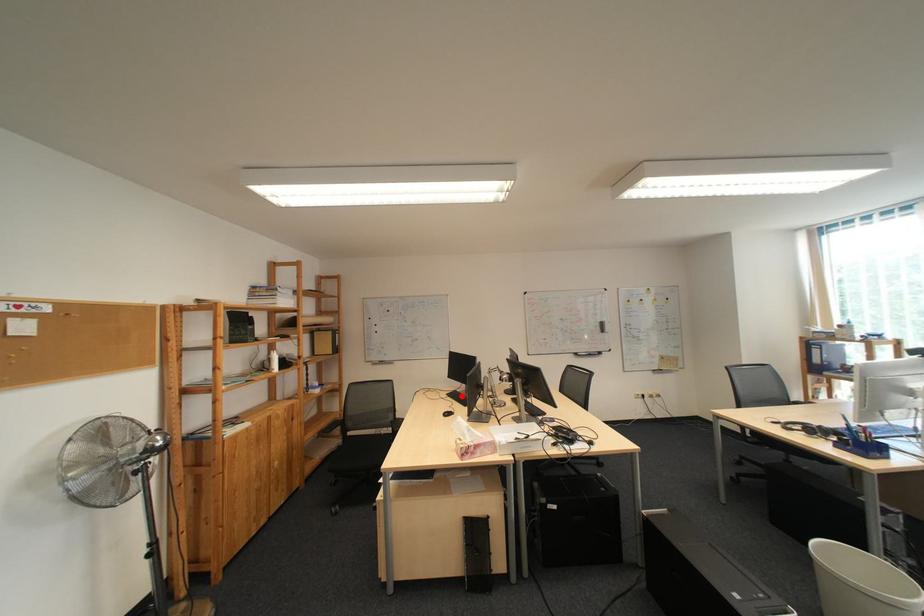
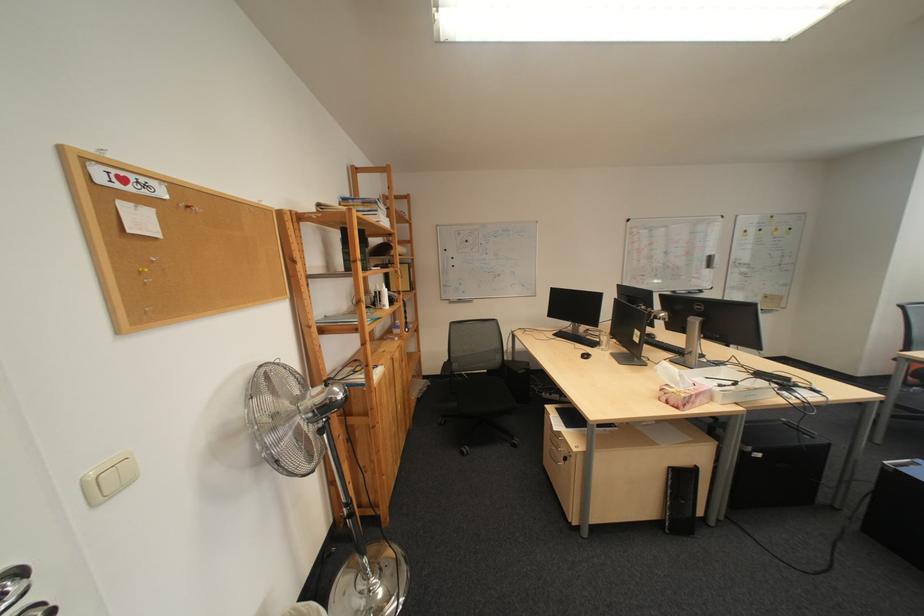
Where in the second image is the point corresponding to the highlighted location from the first image?

(568, 336)